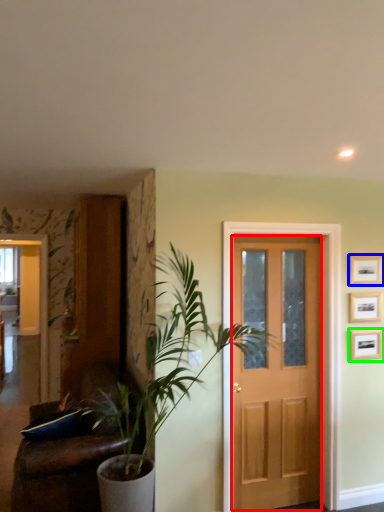
Question: Estimate the real-world distances between objects in this image. Which object is farther from screen door (highlighted by a red box), picture frame (highlighted by a blue box) or picture frame (highlighted by a green box)?

Choices:
 (A) picture frame
 (B) picture frame

Answer: (A)